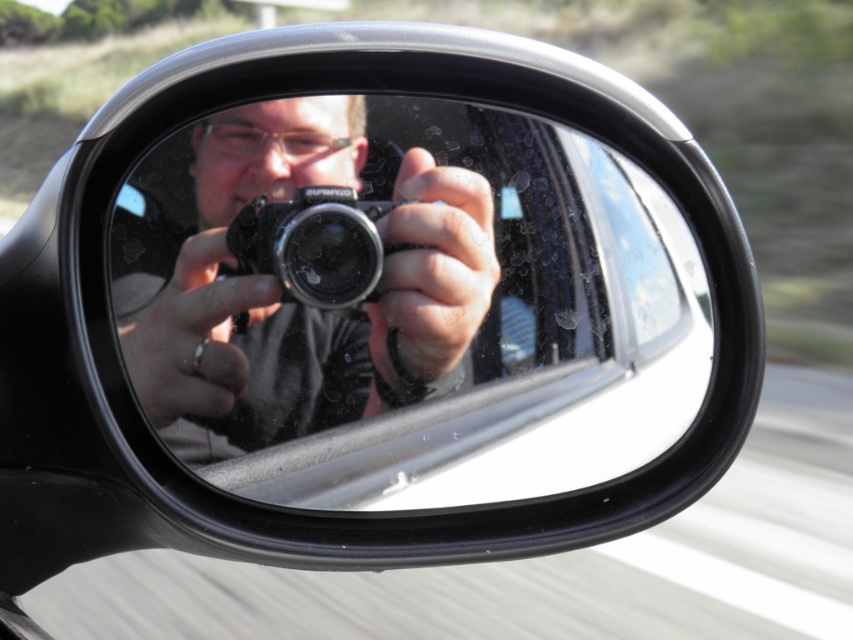
Question: Is matte black camera at center above black plastic camera at center?

Choices:
 (A) no
 (B) yes

Answer: (A)

Question: In this image, where is matte black camera at center located relative to black plastic camera at center?

Choices:
 (A) left
 (B) right

Answer: (A)

Question: Can you confirm if matte black camera at center is bigger than black plastic camera at center?

Choices:
 (A) no
 (B) yes

Answer: (B)

Question: Among these objects, which one is nearest to the camera?

Choices:
 (A) matte black camera at center
 (B) black plastic camera at center

Answer: (A)

Question: Which point appears closest to the camera in this image?

Choices:
 (A) (363, 282)
 (B) (434, 266)

Answer: (A)